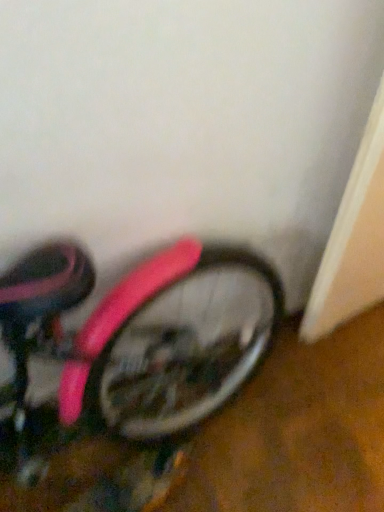
What do you see at coordinates (123, 371) in the screenshot? I see `pink matte bicycle at lower left` at bounding box center [123, 371].

Where is `pink matte bicycle at lower left`? This screenshot has width=384, height=512. pink matte bicycle at lower left is located at coordinates (123, 371).

Image resolution: width=384 pixels, height=512 pixels. Find the location of `pink matte bicycle at lower left`. pink matte bicycle at lower left is located at coordinates (123, 371).